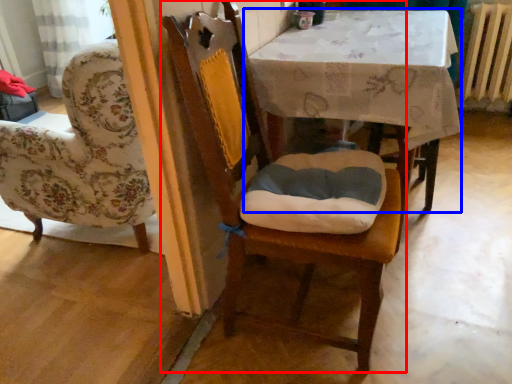
Question: Which point is further to the camera, chair (highlighted by a red box) or table (highlighted by a blue box)?

Choices:
 (A) chair
 (B) table

Answer: (B)